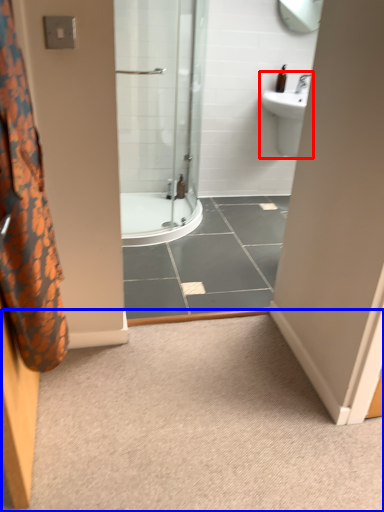
Question: Which of the following is the farthest to the observer, sink (highlighted by a red box) or plain (highlighted by a blue box)?

Choices:
 (A) sink
 (B) plain

Answer: (A)